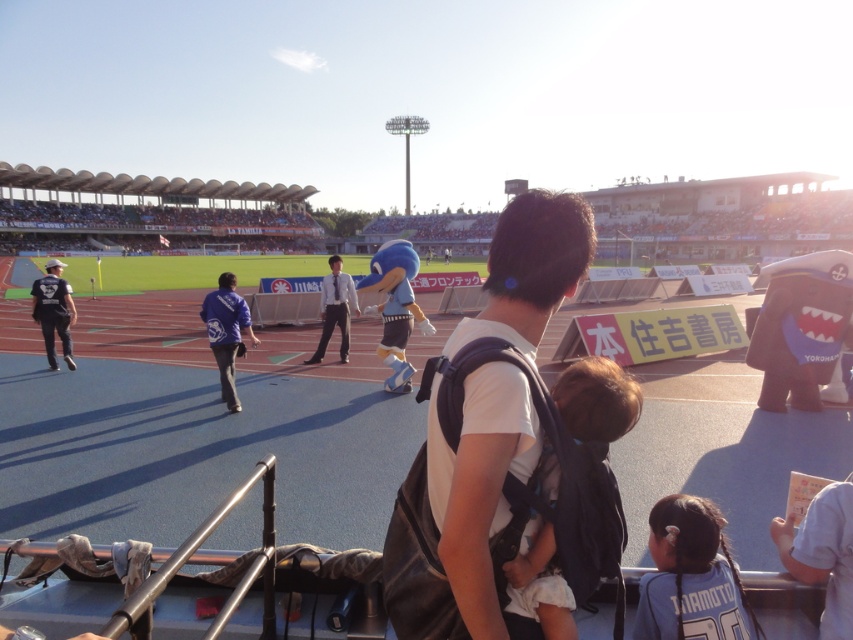
Does white cotton shirt at center appear over blue fabric jacket at center?

No, white cotton shirt at center is not above blue fabric jacket at center.

Does white cotton shirt at center have a smaller size compared to blue fabric jacket at center?

Indeed, white cotton shirt at center has a smaller size compared to blue fabric jacket at center.

Is point (489, 513) closer to camera compared to point (216, 300)?

Yes, point (489, 513) is in front of point (216, 300).

This screenshot has height=640, width=853. What are the coordinates of `white cotton shirt at center` in the screenshot? It's located at (479, 484).

Who is positioned more to the left, brown fabric baby carrier at center or blue fabric jacket at center?

blue fabric jacket at center is more to the left.

How much distance is there between brown fabric baby carrier at center and blue fabric jacket at center?

A distance of 20.29 feet exists between brown fabric baby carrier at center and blue fabric jacket at center.

This screenshot has width=853, height=640. In order to click on brown fabric baby carrier at center in this screenshot , I will do `click(596, 401)`.

At what (x,y) coordinates should I click in order to perform the action: click on brown fabric baby carrier at center. Please return your answer as a coordinate pair (x, y). The image size is (853, 640). Looking at the image, I should click on (596, 401).

What do you see at coordinates (225, 332) in the screenshot? I see `blue fabric jacket at center` at bounding box center [225, 332].

In the scene shown: Which of these two, blue fabric jacket at center or white shirt and tie at center, stands taller?

With more height is white shirt and tie at center.

The height and width of the screenshot is (640, 853). Describe the element at coordinates (225, 332) in the screenshot. I see `blue fabric jacket at center` at that location.

Where is `blue fabric jacket at center`? This screenshot has width=853, height=640. blue fabric jacket at center is located at coordinates (225, 332).